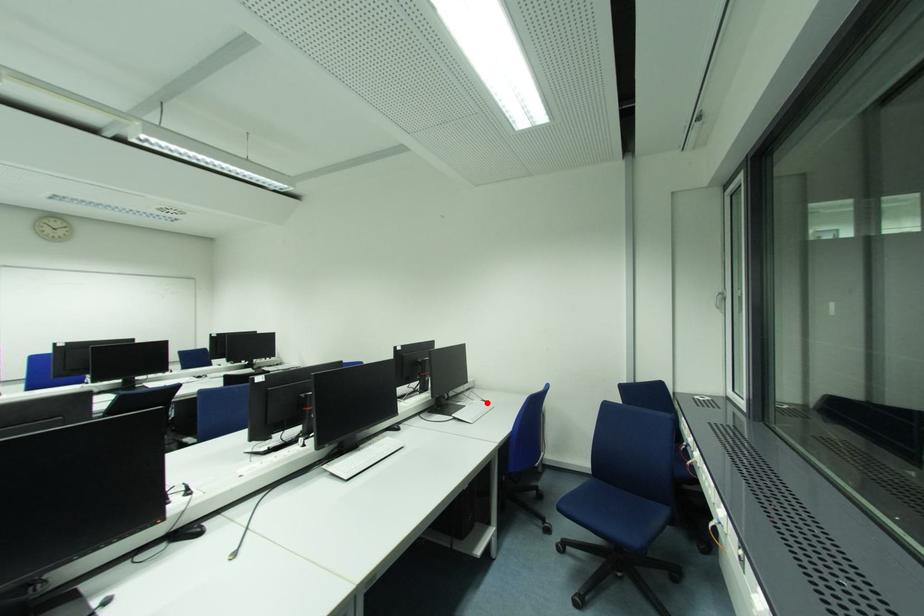
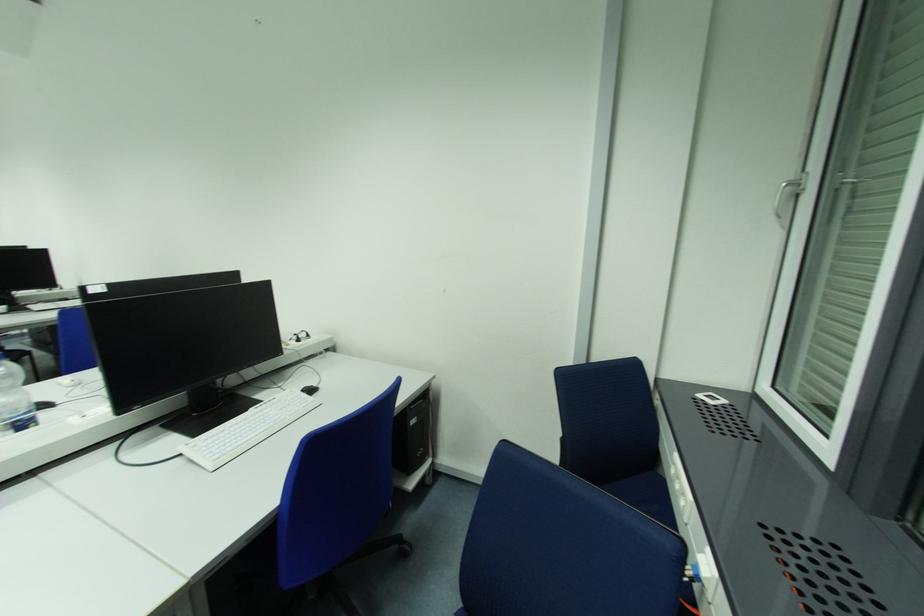
Where in the second image is the point corresponding to the highlighted location from the first image?

(312, 392)